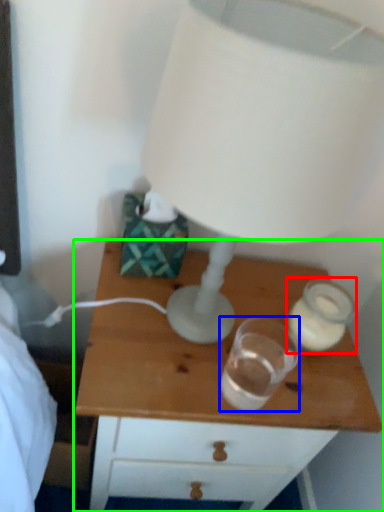
Question: Estimate the real-world distances between objects in this image. Which object is closer to candle holder (highlighted by a red box), candle holder (highlighted by a blue box) or nightstand (highlighted by a green box)?

Choices:
 (A) candle holder
 (B) nightstand

Answer: (A)